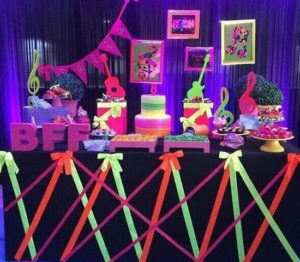
At what (x,y) coordinates should I click in order to perform the action: click on picture. Please return your answer as a coordinate pair (x, y). This screenshot has width=300, height=262. Looking at the image, I should click on (243, 59).